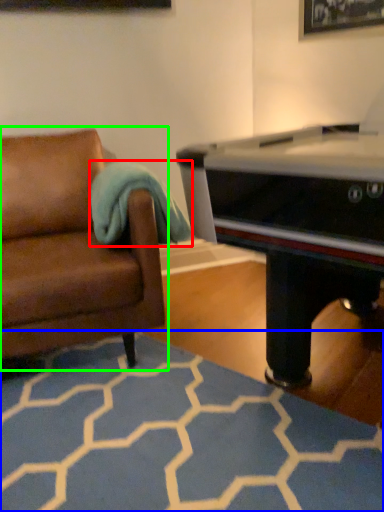
Question: Which object is the farthest from blanket (highlighted by a red box)? Choose among these: plain (highlighted by a blue box) or studio couch (highlighted by a green box).

Choices:
 (A) plain
 (B) studio couch

Answer: (A)